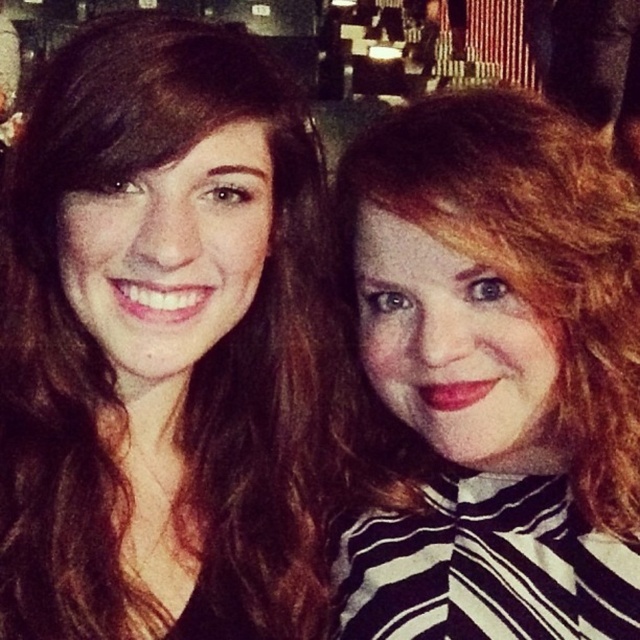
You are a photographer trying to adjust the composition of this photo. You notice two people with matte black hair at left and matte black hair at right. Based on their positions, which person should you ask to move down slightly to align their heads horizontally?

The matte black hair at left is above matte black hair at right. Therefore, you should ask the person with matte black hair at left to move down slightly so their heads align horizontally.

You are standing in a room where two points are marked on the floor. The first point is at coordinates point (237, 93) and the second point is at point (596, 616). If you want to walk from the first point to the second point, which direction should you face?

Point (237, 93) is in front of point (596, 616), so you should face towards the direction of the second point to walk from the first point to the second point.